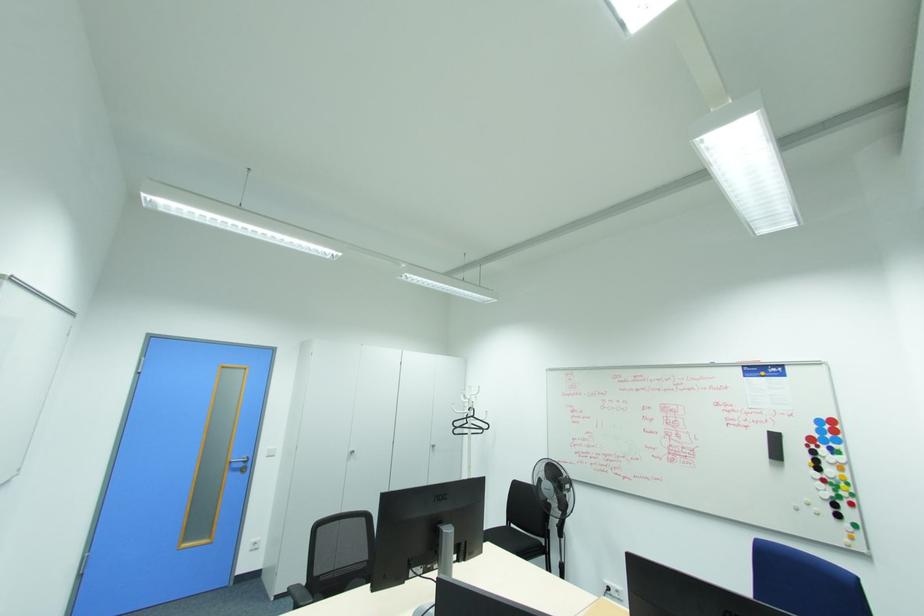
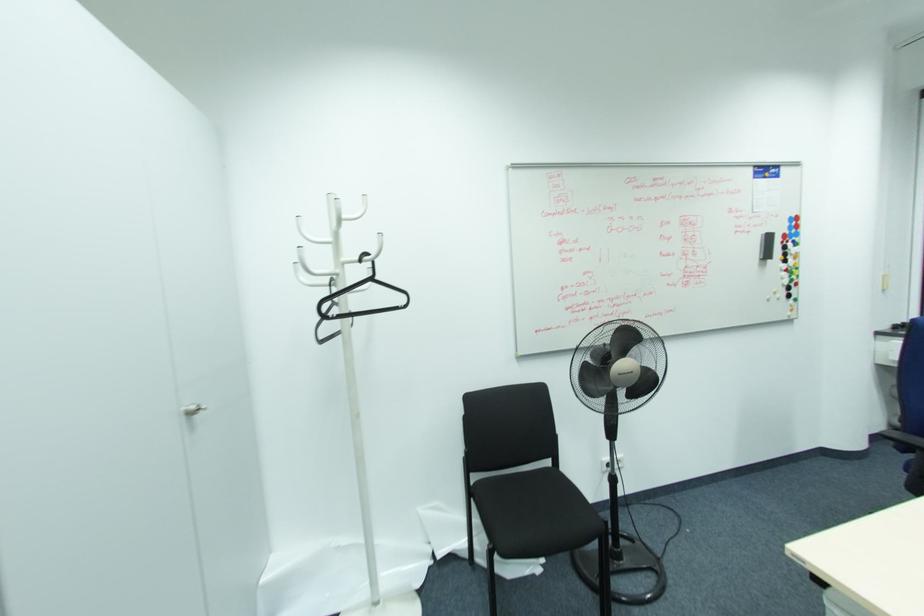
Locate, in the second image, the point that corresponds to (473,416) in the first image.

(371, 280)